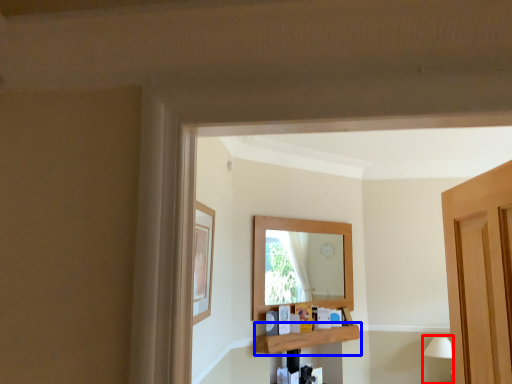
Question: Which object is further to the camera taking this photo, lamp (highlighted by a red box) or shelf (highlighted by a blue box)?

Choices:
 (A) lamp
 (B) shelf

Answer: (A)